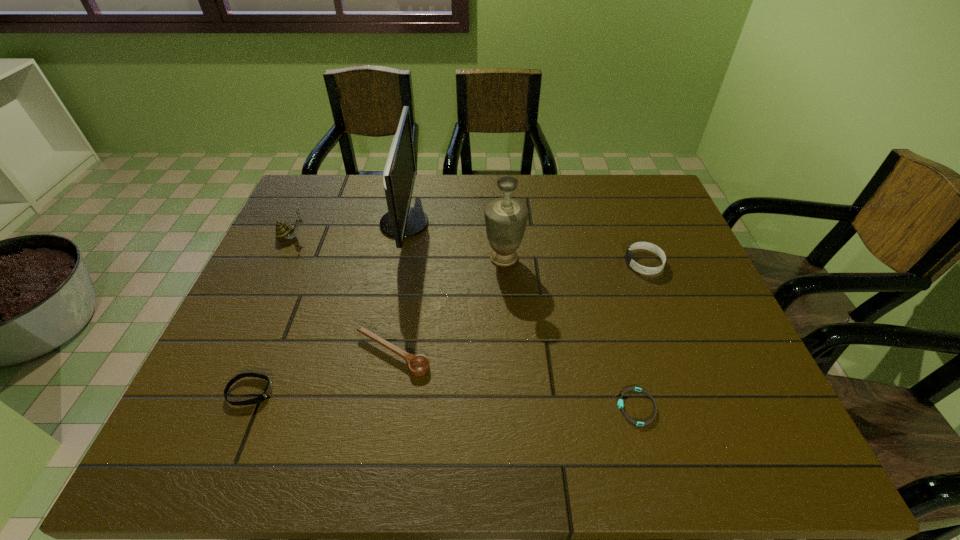
Find the location of `vacant space that satisfies the following two spatial constraints: 1. on the face of the third shortest object; 2. on the left side of the snail`. vacant space that satisfies the following two spatial constraints: 1. on the face of the third shortest object; 2. on the left side of the snail is located at coordinates (238, 354).